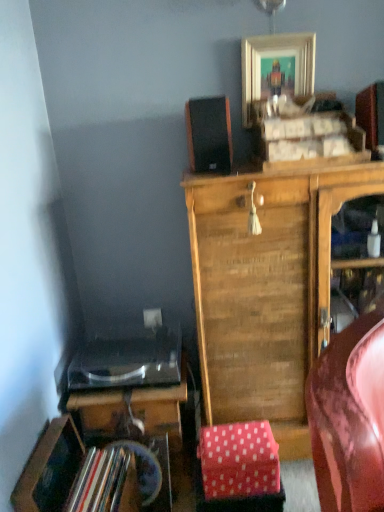
Question: Is gold metallic picture frame at upper center oriented away from pink polka dot fabric at lower center?

Choices:
 (A) yes
 (B) no

Answer: (B)

Question: Is gold metallic picture frame at upper center at the left side of pink polka dot fabric at lower center?

Choices:
 (A) yes
 (B) no

Answer: (B)

Question: Is gold metallic picture frame at upper center positioned far away from pink polka dot fabric at lower center?

Choices:
 (A) yes
 (B) no

Answer: (A)

Question: From the image's perspective, is gold metallic picture frame at upper center under pink polka dot fabric at lower center?

Choices:
 (A) yes
 (B) no

Answer: (B)

Question: Considering the relative positions of gold metallic picture frame at upper center and pink polka dot fabric at lower center in the image provided, is gold metallic picture frame at upper center to the right of pink polka dot fabric at lower center from the viewer's perspective?

Choices:
 (A) no
 (B) yes

Answer: (B)

Question: Is gold metallic picture frame at upper center bigger than pink polka dot fabric at lower center?

Choices:
 (A) yes
 (B) no

Answer: (B)

Question: Considering the relative sizes of pink polka dot fabric at lower center and shiny black desk at lower left in the image provided, is pink polka dot fabric at lower center shorter than shiny black desk at lower left?

Choices:
 (A) yes
 (B) no

Answer: (A)

Question: Is pink polka dot fabric at lower center not close to shiny black desk at lower left?

Choices:
 (A) yes
 (B) no

Answer: (B)

Question: Does pink polka dot fabric at lower center have a larger size compared to shiny black desk at lower left?

Choices:
 (A) yes
 (B) no

Answer: (B)

Question: Is pink polka dot fabric at lower center wider than shiny black desk at lower left?

Choices:
 (A) no
 (B) yes

Answer: (A)

Question: Can you confirm if pink polka dot fabric at lower center is smaller than shiny black desk at lower left?

Choices:
 (A) no
 (B) yes

Answer: (B)

Question: Is pink polka dot fabric at lower center not within shiny black desk at lower left?

Choices:
 (A) yes
 (B) no

Answer: (A)

Question: Considering the relative sizes of black matte speaker at upper center and pink polka dot fabric at lower center in the image provided, is black matte speaker at upper center bigger than pink polka dot fabric at lower center?

Choices:
 (A) yes
 (B) no

Answer: (A)